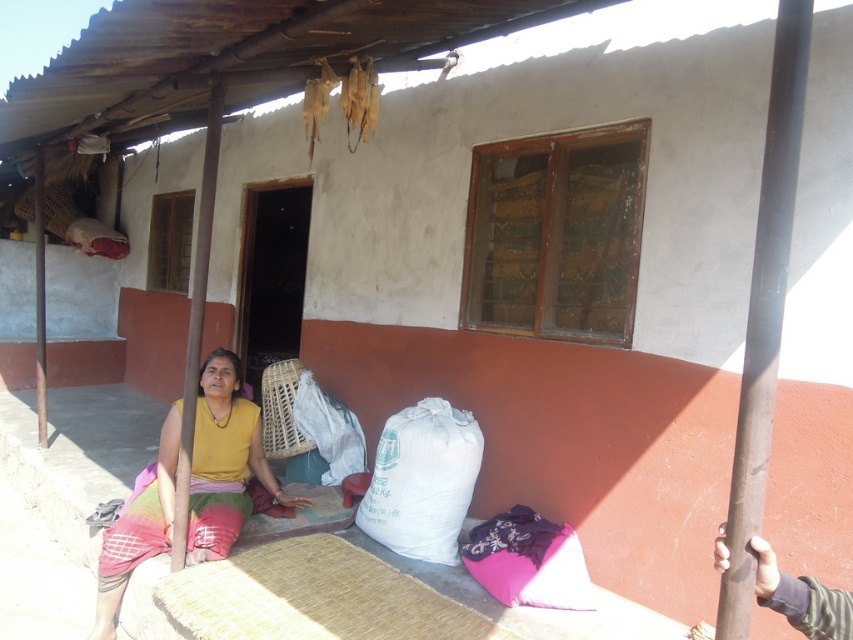
You are a fashion designer observing the image. You need to determine which fabric item is taller between the yellow fabric at center and the white fabric sack at lower center. Can you identify which one is taller?

The yellow fabric at center has a greater height compared to the white fabric sack at lower center, so the yellow fabric at center is taller.

You are a photographer trying to capture the woman in the yellow fabric at center without the white fabric sack at lower center blocking her. Based on their positions, is this possible?

The yellow fabric at center is positioned under the white fabric sack at lower center, so the sack is blocking the view of the woman. To capture her without the sack blocking, you would need to adjust your angle or move the sack.

You are standing in the scene and want to touch the yellow fabric at center. Which direction should you move your hand to reach it?

You should move your hand towards the center of the scene to reach the yellow fabric at center, as it is located at point (225, 461).